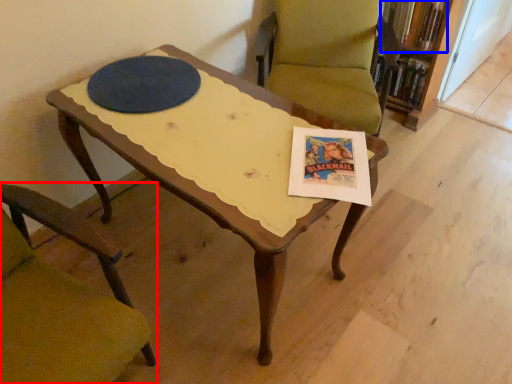
Question: Among these objects, which one is nearest to the camera, chair (highlighted by a red box) or book (highlighted by a blue box)?

Choices:
 (A) chair
 (B) book

Answer: (A)